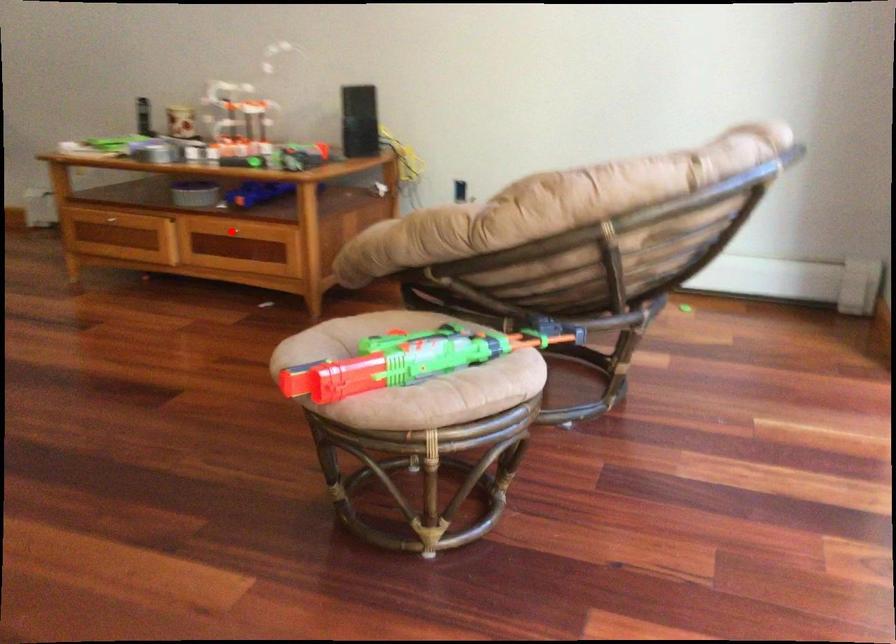
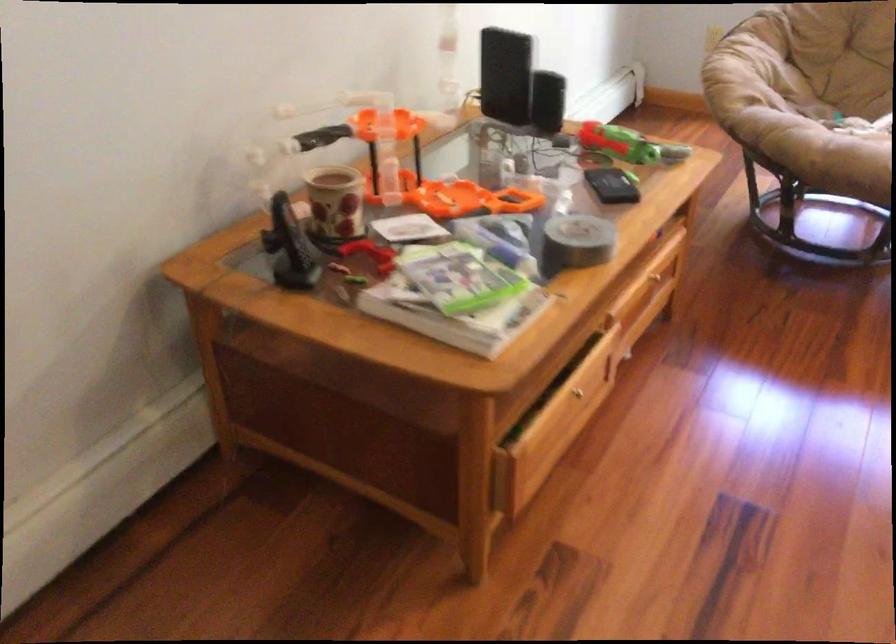
Question: A red point is marked in image1. In image2, is the corresponding 3D point closer to the camera or farther? Reply with the corresponding letter.

Choices:
 (A) The corresponding 3D point is closer.
 (B) The corresponding 3D point is farther.

Answer: (A)